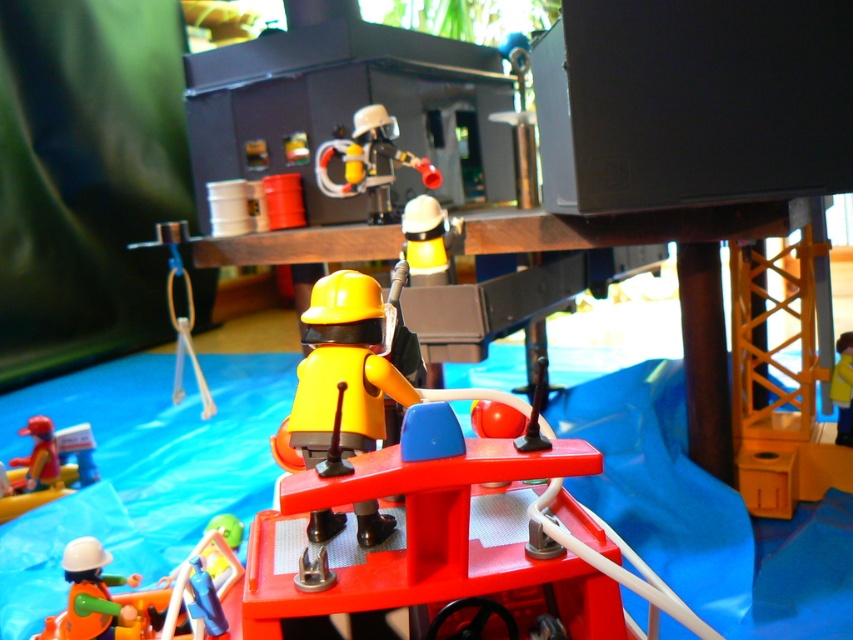
Which of these two, matte yellow helmet at center or yellow matte helmet at upper center, stands taller?

Standing taller between the two is matte yellow helmet at center.

Does matte yellow helmet at center come behind yellow matte helmet at upper center?

No.

Where is `matte yellow helmet at center`? The image size is (853, 640). matte yellow helmet at center is located at coordinates (347, 372).

I want to click on matte yellow helmet at center, so click(347, 372).

Can you confirm if matte yellow helmet at center is positioned to the left of smooth plastic fire extinguisher at upper center?

Indeed, matte yellow helmet at center is positioned on the left side of smooth plastic fire extinguisher at upper center.

Between point (364, 305) and point (334, 192), which one is positioned in front?

Point (364, 305)

You are a GUI agent. You are given a task and a screenshot of the screen. Output one action in this format:
    pyautogui.click(x=<x>, y=<y>)
    Task: Click on the matte yellow helmet at center
    The height and width of the screenshot is (640, 853).
    Given the screenshot: What is the action you would take?
    pyautogui.click(x=347, y=372)

Does matte red helmet at lower left appear under yellow plastic ladder at center?

Yes.

Is point (32, 468) positioned after point (839, 388)?

Yes, it is.

Image resolution: width=853 pixels, height=640 pixels. Find the location of `matte red helmet at lower left`. matte red helmet at lower left is located at coordinates (39, 452).